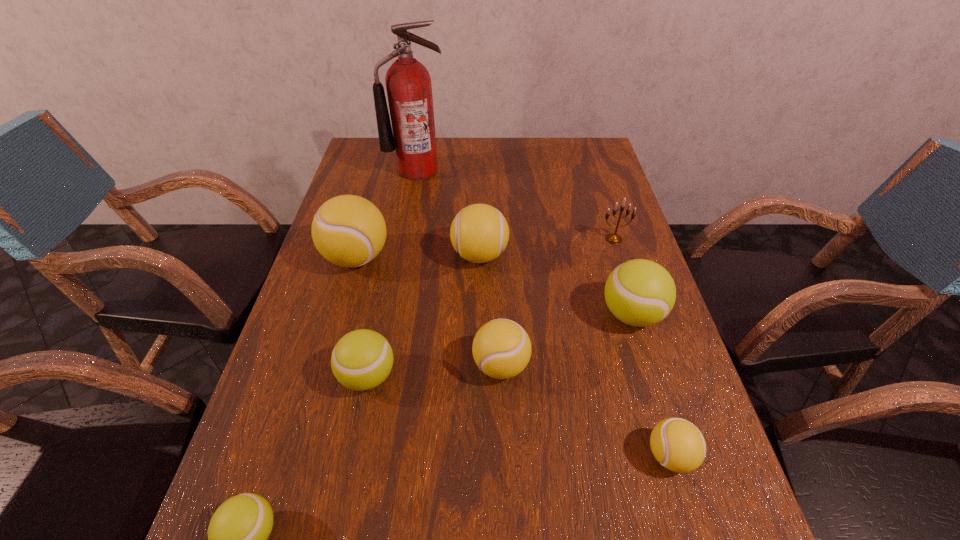
At what (x,y) coordinates should I click in order to perform the action: click on the tallest object. Please return your answer as a coordinate pair (x, y). This screenshot has height=540, width=960. Looking at the image, I should click on pyautogui.click(x=409, y=90).

Identify the location of the farthest object. The height and width of the screenshot is (540, 960). (409, 90).

This screenshot has height=540, width=960. What are the coordinates of `the tallest tennis ball` in the screenshot? It's located at (349, 231).

What are the coordinates of `the biggest yellow tennis ball` in the screenshot? It's located at (349, 231).

The image size is (960, 540). I want to click on the biggest green tennis ball, so click(639, 292).

Locate an element on the screen. the fifth farthest object is located at coordinates (639, 292).

You are a GUI agent. You are given a task and a screenshot of the screen. Output one action in this format:
    pyautogui.click(x=<x>, y=<y>)
    Task: Click on the second biggest yellow tennis ball
    
    Given the screenshot: What is the action you would take?
    coord(479,232)

I want to click on candelabrum, so click(613, 238).

Locate an element on the screen. This screenshot has height=540, width=960. the second smallest yellow tennis ball is located at coordinates (501, 348).

You are a GUI agent. You are given a task and a screenshot of the screen. Output one action in this format:
    pyautogui.click(x=<x>, y=<y>)
    Task: Click on the second farthest green tennis ball
    The image size is (960, 540).
    Given the screenshot: What is the action you would take?
    pyautogui.click(x=362, y=359)